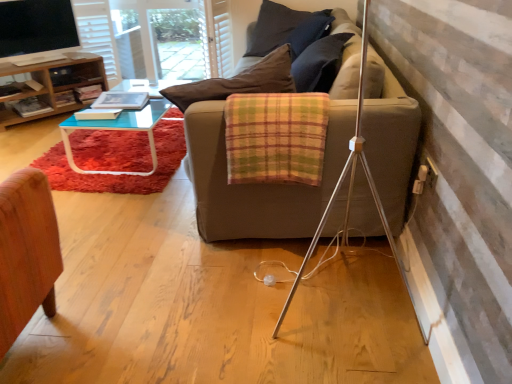
Question: Is plaid fabric blanket at center spatially inside matte black screen at upper left, or outside of it?

Choices:
 (A) inside
 (B) outside

Answer: (B)

Question: Is plaid fabric blanket at center wider or thinner than matte black screen at upper left?

Choices:
 (A) wide
 (B) thin

Answer: (A)

Question: Estimate the real-world distances between objects in this image. Which object is farther from the dark fabric pillow at upper center?

Choices:
 (A) matte black screen at upper left
 (B) white textured curtain at upper center
 (C) transparent glass screen door at upper left
 (D) plaid fabric blanket at center
 (E) woodenmaterial/texturetable at left

Answer: (D)

Question: Considering the real-world distances, which object is farthest from the matte black screen at upper left?

Choices:
 (A) transparent glass screen door at upper left
 (B) dark fabric pillow at upper center
 (C) woodenmaterial/texturetable at left
 (D) white textured curtain at upper center
 (E) plaid fabric blanket at center

Answer: (E)